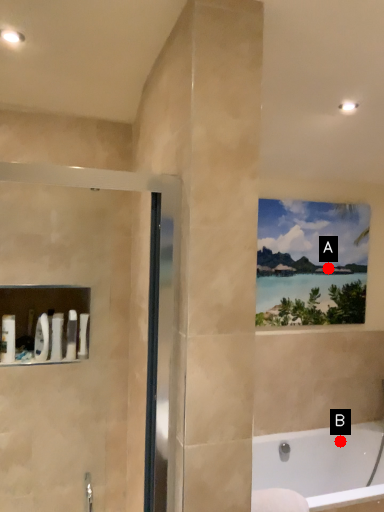
Question: Two points are circled on the image, labeled by A and B beside each circle. Which of the following is the closest to the observer?

Choices:
 (A) A is closer
 (B) B is closer

Answer: (B)